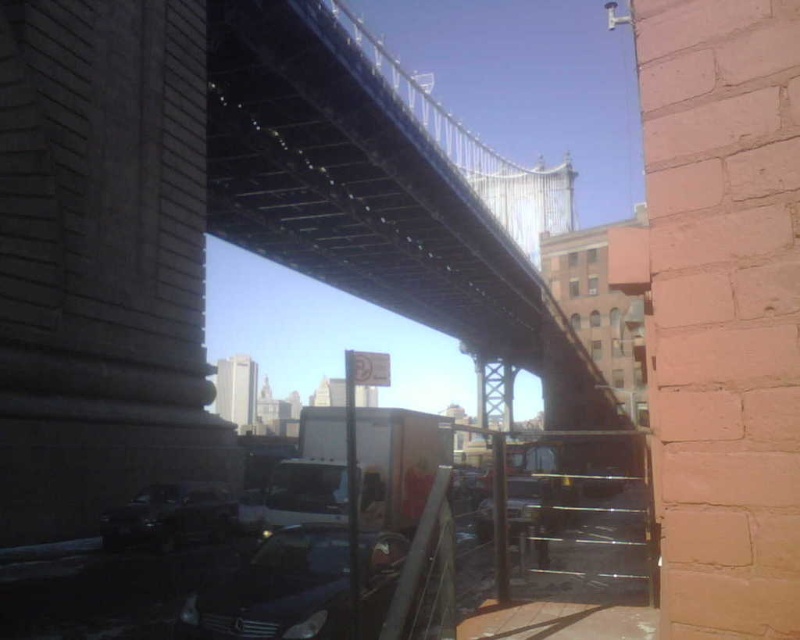
From the picture: You are a pedestrian standing on the sidewalk and want to cross the road to reach the brick wall on the right. There are two cars in your path. Which car should you move around first, the shiny black car at lower left or the metallic silver car at center?

You should move around the shiny black car at lower left first because it is positioned to the left of the metallic silver car at center, meaning it is closer to your starting point on the sidewalk.

You are a photographer trying to capture both the shiny black car at lower center and the metallic silver car at center in a single shot. Based on their positions, which car should you adjust your camera angle to focus on first to ensure both are in frame?

The shiny black car at lower center is to the left of the metallic silver car at center, so you should focus on the metallic silver car at center first to ensure both cars are included in the frame.

Based on the photo, you are a pedestrian standing at the base of the bridge and see both the shiny black car at lower center and the shiny black car at lower left. Which car is closer to you?

The shiny black car at lower left is closer to you because the shiny black car at lower center is located above it, meaning it is positioned further back in the scene.